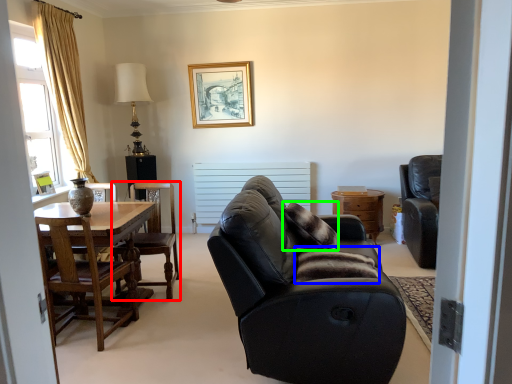
Question: Based on their relative distances, which object is nearer to chair (highlighted by a red box)? Choose from pillow (highlighted by a blue box) and pillow (highlighted by a green box).

Choices:
 (A) pillow
 (B) pillow

Answer: (B)